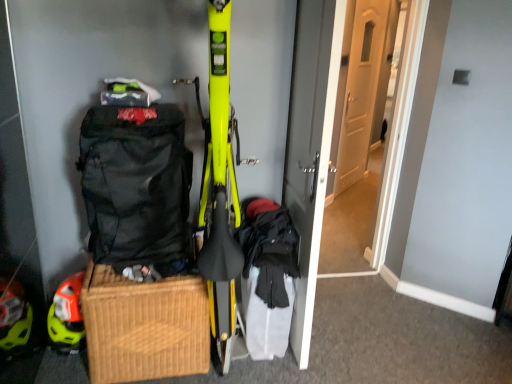
Find the location of `free point below orange matte helmet at lower left (from a real-world perspective)`. free point below orange matte helmet at lower left (from a real-world perspective) is located at coordinates (67, 356).